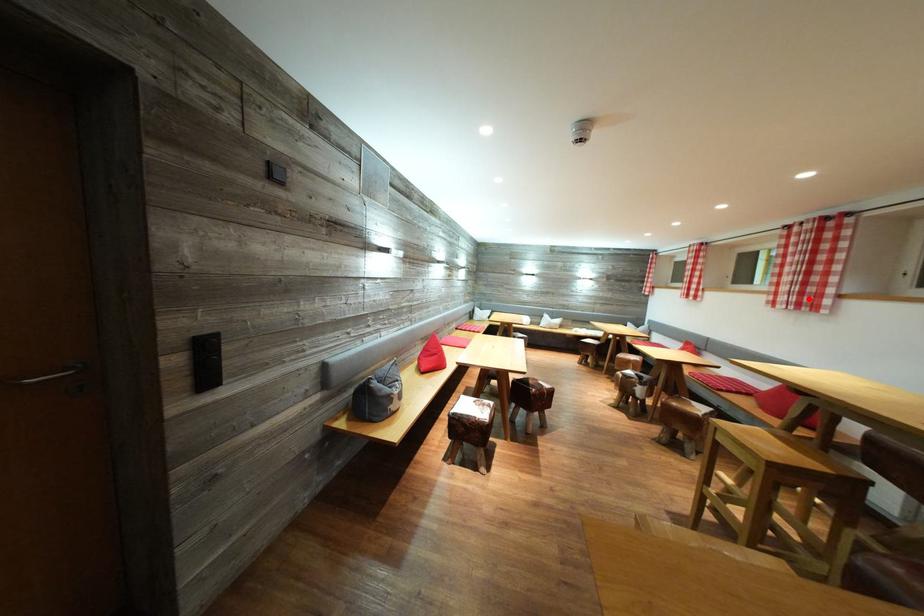
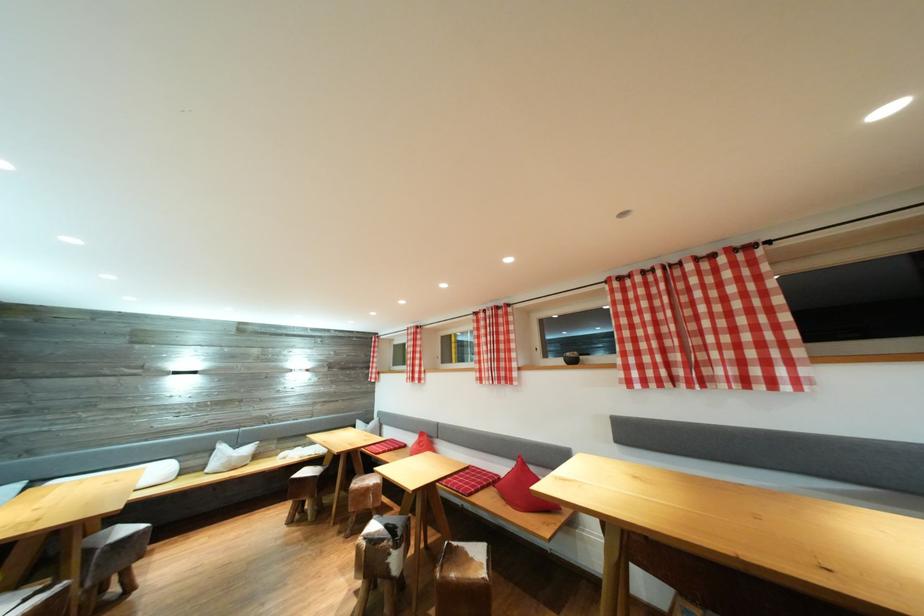
Where in the second image is the point corresponding to the highlighted location from the first image?

(505, 374)